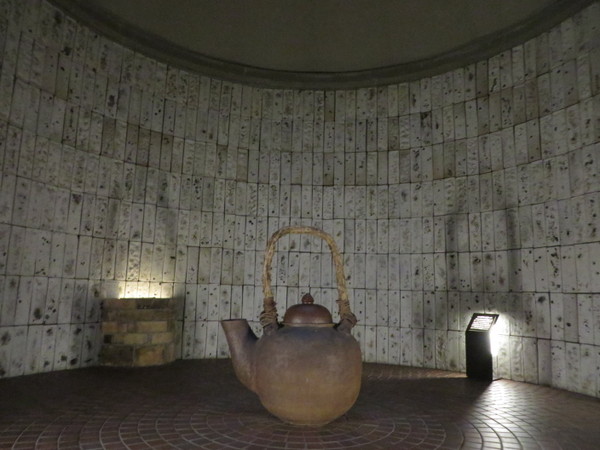
Where is `alcove`? alcove is located at coordinates (137, 336).